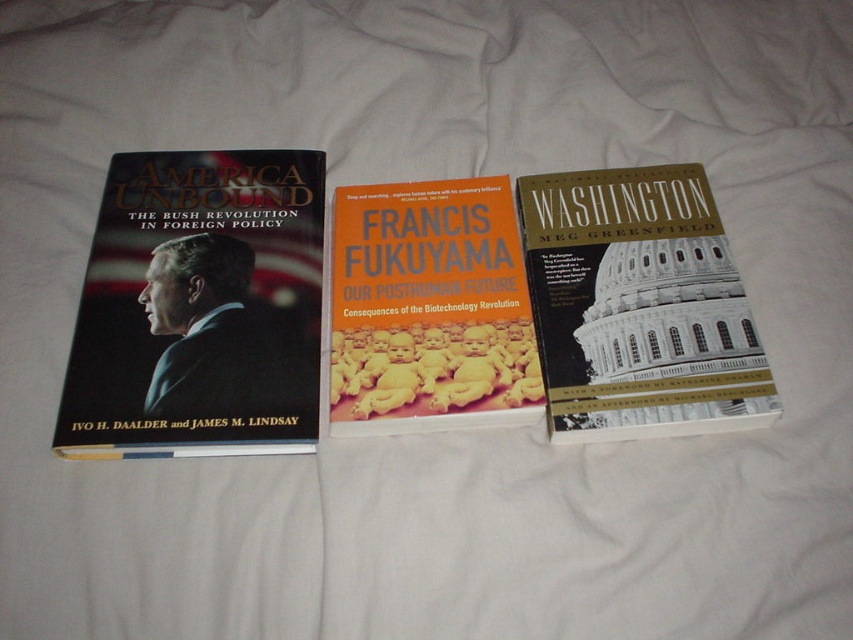
Question: Observing the image, what is the correct spatial positioning of hardcover book at center in reference to orange matte book at center?

Choices:
 (A) below
 (B) above

Answer: (B)

Question: Estimate the real-world distances between objects in this image. Which object is closer to the orange matte book at center?

Choices:
 (A) hardcover book at center
 (B) hardcover book at left

Answer: (A)

Question: Is hardcover book at left to the left of orange matte book at center from the viewer's perspective?

Choices:
 (A) yes
 (B) no

Answer: (A)

Question: Considering the real-world distances, which object is farthest from the hardcover book at center?

Choices:
 (A) hardcover book at left
 (B) orange matte book at center

Answer: (A)

Question: Which of the following is the closest to the observer?

Choices:
 (A) pyautogui.click(x=683, y=236)
 (B) pyautogui.click(x=508, y=365)

Answer: (B)

Question: Does hardcover book at left have a smaller size compared to hardcover book at center?

Choices:
 (A) yes
 (B) no

Answer: (B)